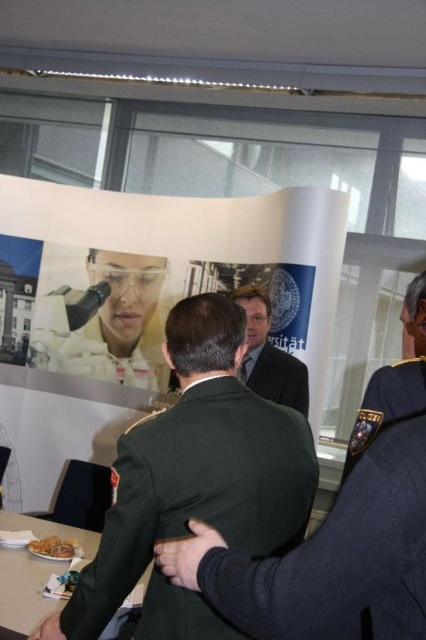
Based on the photo, you are a guest at this event and want to place a gift on the wooden table at center. However, there is a green military uniform at center in the way. Can you place the gift directly on the table without moving the uniform?

The wooden table at center is positioned under the green military uniform at center, so you can place the gift directly on the table without needing to move the uniform as it is located beneath the uniform.

In the scene, you are standing at the back of the room and want to see the large display board behind the dark green fabric uniform at center and the wooden table at center. Which object is blocking your view more?

The wooden table at center is blocking your view more because it occupies more space than the dark green fabric uniform at center according to the description.